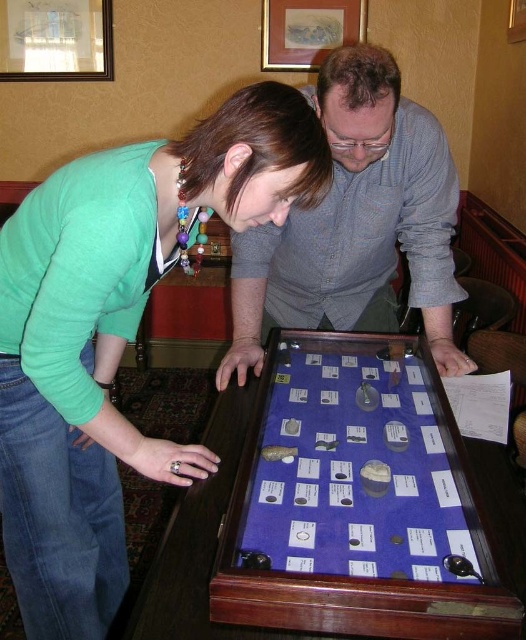
Question: Where is blue velvet display case at center located in relation to gray checkered shirt at center in the image?

Choices:
 (A) left
 (B) right

Answer: (A)

Question: Among these objects, which one is nearest to the camera?

Choices:
 (A) gray checkered shirt at center
 (B) blue velvet game at center
 (C) blue velvet display case at center

Answer: (C)

Question: Among these points, which one is nearest to the camera?

Choices:
 (A) (329, 227)
 (B) (173, 198)

Answer: (B)

Question: Is blue velvet game at center closer to the viewer compared to gray checkered shirt at center?

Choices:
 (A) no
 (B) yes

Answer: (B)

Question: Which of the following is the closest to the observer?

Choices:
 (A) (369, 492)
 (B) (180, 468)
 (C) (345, 237)
 (D) (198, 570)

Answer: (D)

Question: Where is blue velvet game at center located in relation to gray checkered shirt at center in the image?

Choices:
 (A) left
 (B) right

Answer: (A)